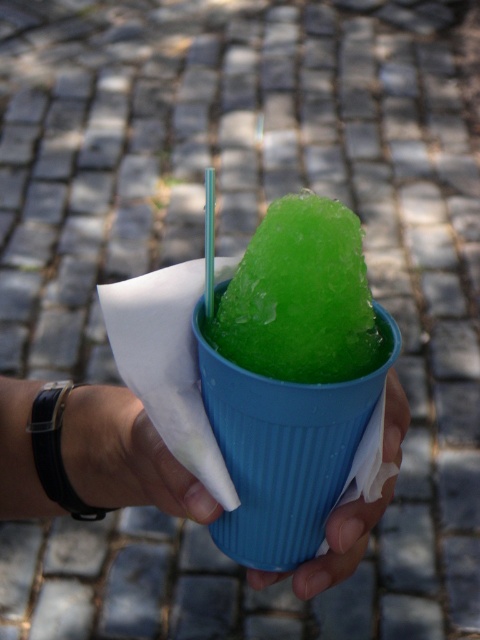
Question: Which of the following is the closest to the observer?

Choices:
 (A) smooth skin hand at center
 (B) green frosted ice at center
 (C) blue plastic cup at center

Answer: (B)

Question: Does green frosted ice at center appear on the right side of blue plastic cup at center?

Choices:
 (A) yes
 (B) no

Answer: (B)

Question: Which of the following is the closest to the observer?

Choices:
 (A) smooth skin hand at center
 (B) green frosted ice at center
 (C) blue plastic cup at center

Answer: (B)

Question: Is green frosted ice at center to the left of blue plastic cup at center from the viewer's perspective?

Choices:
 (A) yes
 (B) no

Answer: (A)

Question: Which object is farther from the camera taking this photo?

Choices:
 (A) green frosted ice at center
 (B) smooth skin hand at center
 (C) blue plastic cup at center

Answer: (B)

Question: Is smooth skin hand at center below blue plastic cup at center?

Choices:
 (A) no
 (B) yes

Answer: (A)